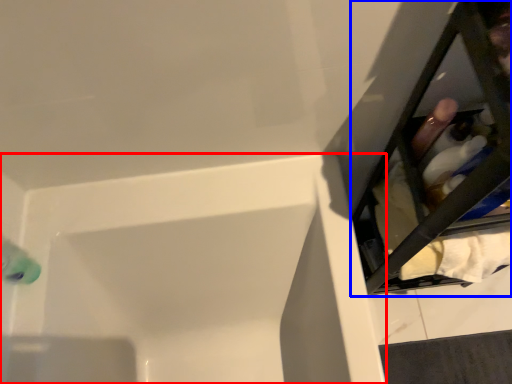
Question: Which object appears closest to the camera in this image, bathtub (highlighted by a red box) or furniture (highlighted by a blue box)?

Choices:
 (A) bathtub
 (B) furniture

Answer: (B)